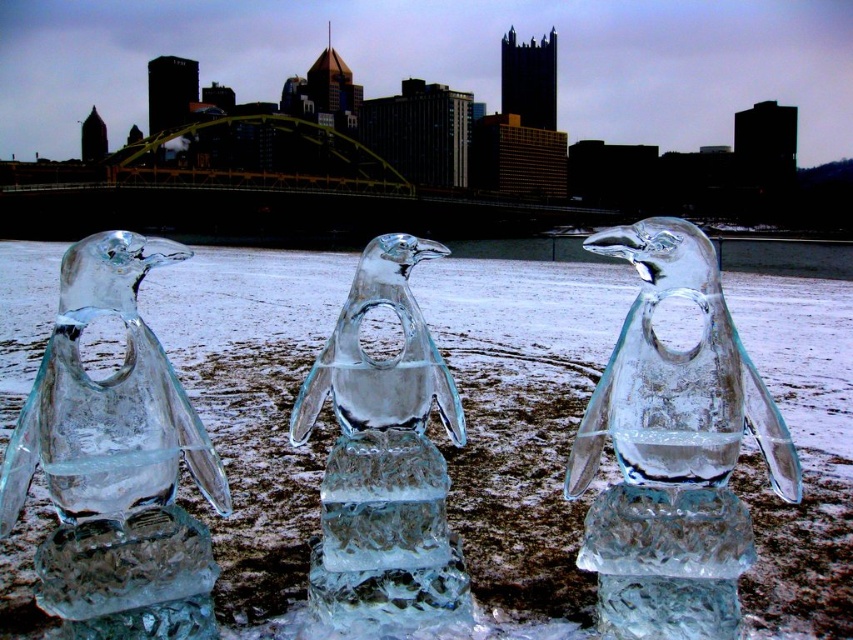
Which is behind, point (380, 268) or point (631, 262)?

The point (380, 268) is behind.

How distant is transparent ice penguin at center from transparent ice penguin at right?

transparent ice penguin at center is 9.60 inches away from transparent ice penguin at right.

Does point (444, 244) lie behind point (686, 227)?

Yes, it is behind point (686, 227).

You are a GUI agent. You are given a task and a screenshot of the screen. Output one action in this format:
    pyautogui.click(x=<x>, y=<y>)
    Task: Click on the transparent ice penguin at center
    
    Given the screenshot: What is the action you would take?
    pyautogui.click(x=384, y=458)

Is transparent ice penguin at left to the left of transparent ice penguin at right from the viewer's perspective?

Indeed, transparent ice penguin at left is positioned on the left side of transparent ice penguin at right.

Does point (138, 605) lie behind point (639, 388)?

That is False.

Measure the distance between point (90, 493) and camera.

Point (90, 493) is 83.71 centimeters from camera.

Where is `transparent ice penguin at left`? The image size is (853, 640). transparent ice penguin at left is located at coordinates (115, 464).

Who is lower down, transparent ice sculpture at center or transparent ice penguin at left?

transparent ice penguin at left is below.

Is transparent ice sculpture at center closer to camera compared to transparent ice penguin at left?

No, it is not.

This screenshot has height=640, width=853. Find the location of `transparent ice sculpture at center`. transparent ice sculpture at center is located at coordinates pos(521,419).

Locate an element on the screen. This screenshot has height=640, width=853. transparent ice sculpture at center is located at coordinates (521, 419).